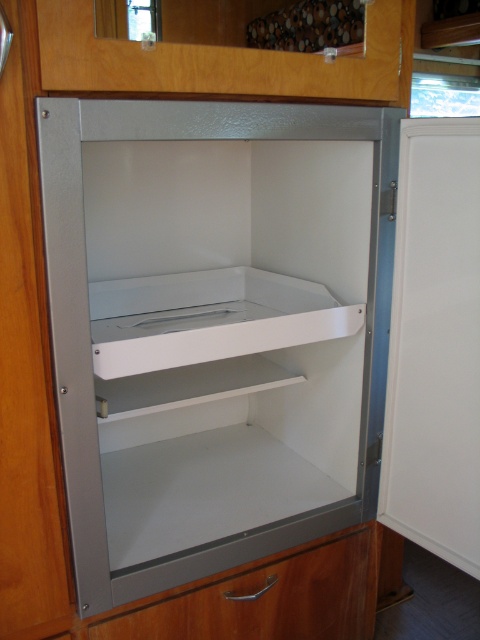
Question: Does white matte cabinet at center have a smaller size compared to matte silver drawer at lower center?

Choices:
 (A) yes
 (B) no

Answer: (B)

Question: Does white matte cabinet at center come in front of matte silver drawer at lower center?

Choices:
 (A) yes
 (B) no

Answer: (A)

Question: Is the position of white matte cabinet at center less distant than that of matte silver drawer at lower center?

Choices:
 (A) no
 (B) yes

Answer: (B)